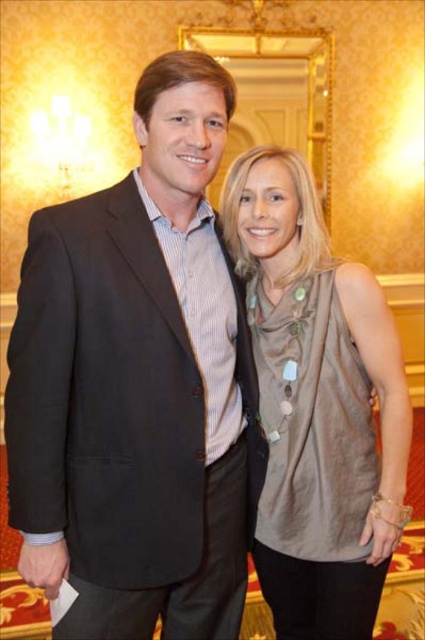
You are a photographer at the event and want to focus on the matte black suit at left and the satin beige top at center. Which one is nearer to you?

The matte black suit at left is closer to the viewer than the satin beige top at center.

You are a photographer at a formal event. You need to capture a closeup of both the matte black suit at left and the satin beige top at center. Given their sizes, which one might require you to step back to frame properly?

The matte black suit at left is bigger than the satin beige top at center, so you would need to step back to frame the matte black suit at left properly.

You are a photographer setting up for a group photo. You need to ensure that the matte black suit at left and the satin beige top at center are at least 14 inches apart to avoid overlapping in the frame. Based on the current positioning, will this requirement be met?

The distance between the matte black suit at left and the satin beige top at center is 12.36 inches, which is less than the required 14 inches. Therefore, they are too close and will overlap in the frame.